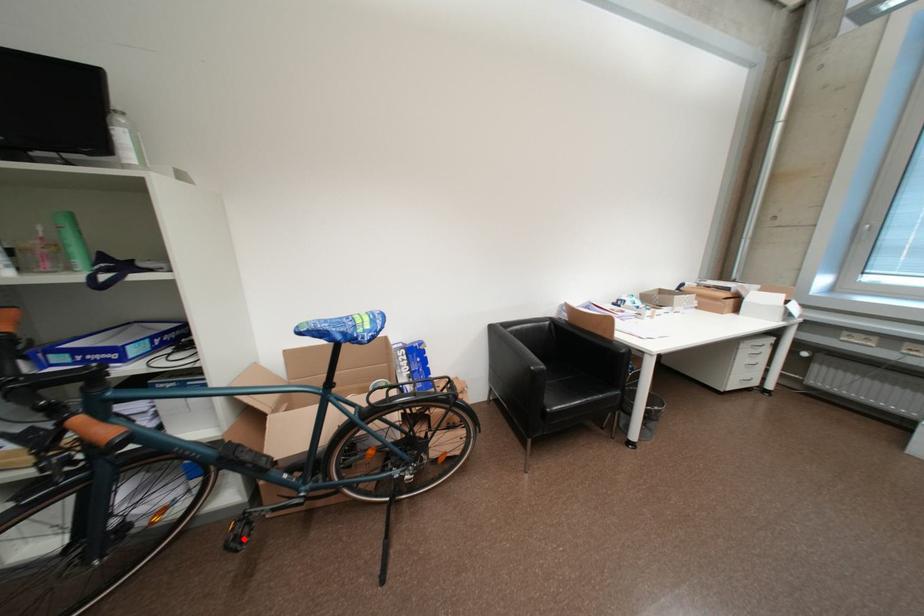
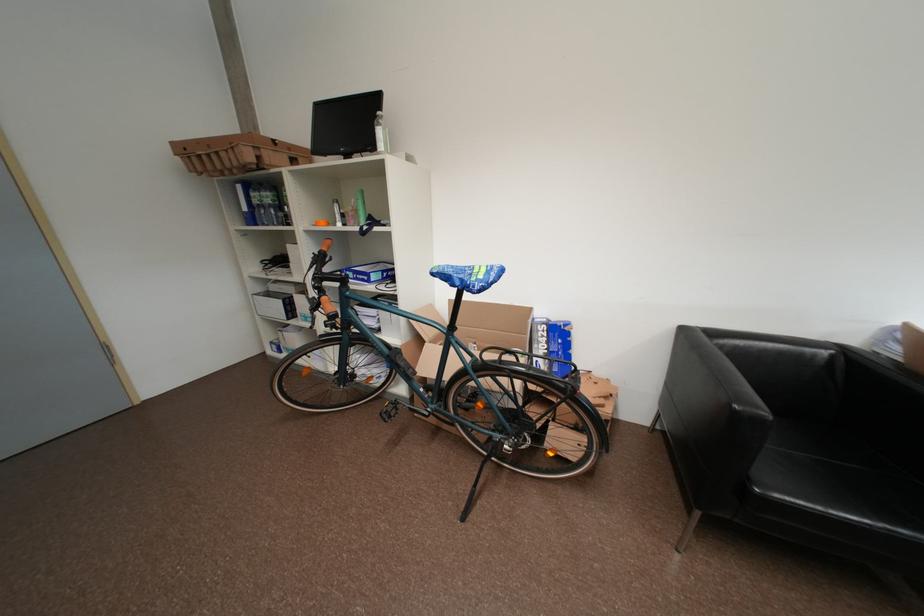
Question: I am providing you with two images of the same scene from different viewpoints. In image1, a red point is highlighted. Considering the same 3D point in image2, which of the following is correct?

Choices:
 (A) It is closer
 (B) It is farther

Answer: (A)